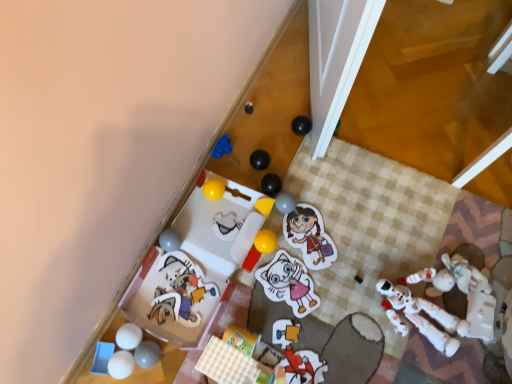
Locate an element on the screen. The width and height of the screenshot is (512, 384). free location to the left of yellow matte block at upper center, placed as the 11th toy when sorted from left to right is located at coordinates (217, 209).